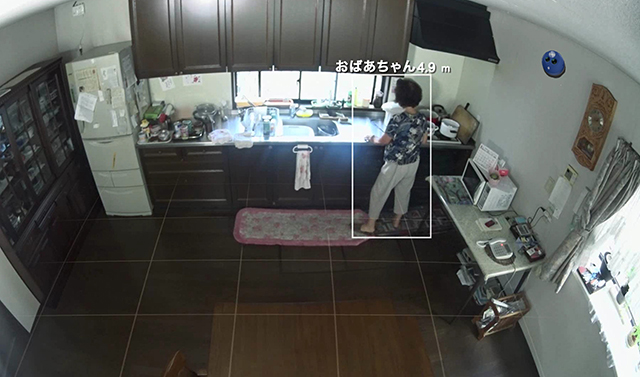
What are the coordinates of `table` in the screenshot? It's located at (468, 220).